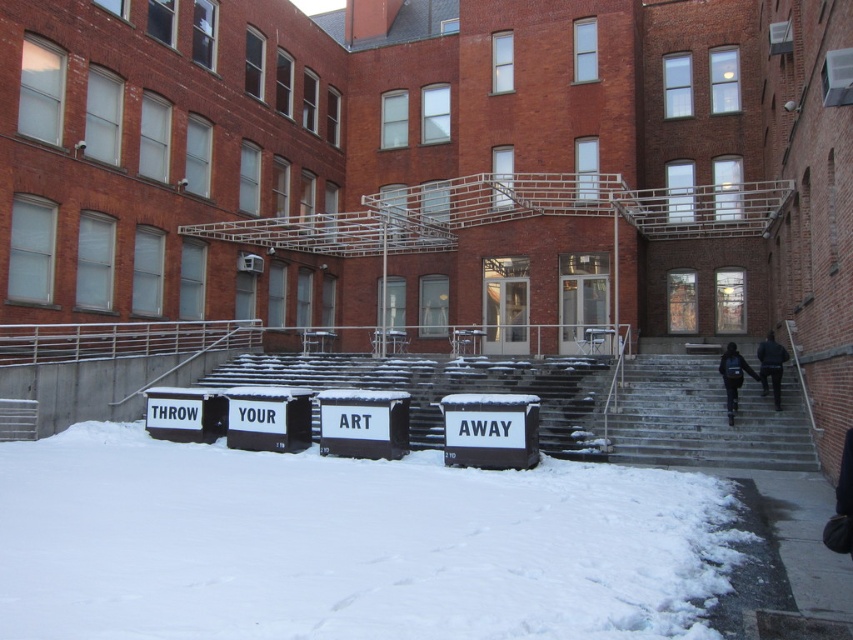
Based on the photo, can you confirm if black fabric jacket at upper right is bigger than dark blue jacket at upper right?

No, black fabric jacket at upper right is not bigger than dark blue jacket at upper right.

Locate an element on the screen. This screenshot has width=853, height=640. black fabric jacket at upper right is located at coordinates (770, 365).

Identify the location of white powdery snow at lower center. (346, 545).

Can you confirm if white powdery snow at lower center is positioned to the right of smooth concrete stairs at right?

No, white powdery snow at lower center is not to the right of smooth concrete stairs at right.

Is point (199, 628) farther from viewer compared to point (670, 444)?

No.

Locate an element on the screen. The image size is (853, 640). white powdery snow at lower center is located at coordinates (346, 545).

Does smooth concrete stairs at right have a lesser width compared to dark blue jacket at upper right?

Correct, smooth concrete stairs at right's width is less than dark blue jacket at upper right's.

Can you confirm if smooth concrete stairs at right is taller than dark blue jacket at upper right?

In fact, smooth concrete stairs at right may be shorter than dark blue jacket at upper right.

Measure the distance between point (718, 401) and camera.

They are 16.67 meters apart.

At what (x,y) coordinates should I click in order to perform the action: click on smooth concrete stairs at right. Please return your answer as a coordinate pair (x, y). Looking at the image, I should click on (704, 419).